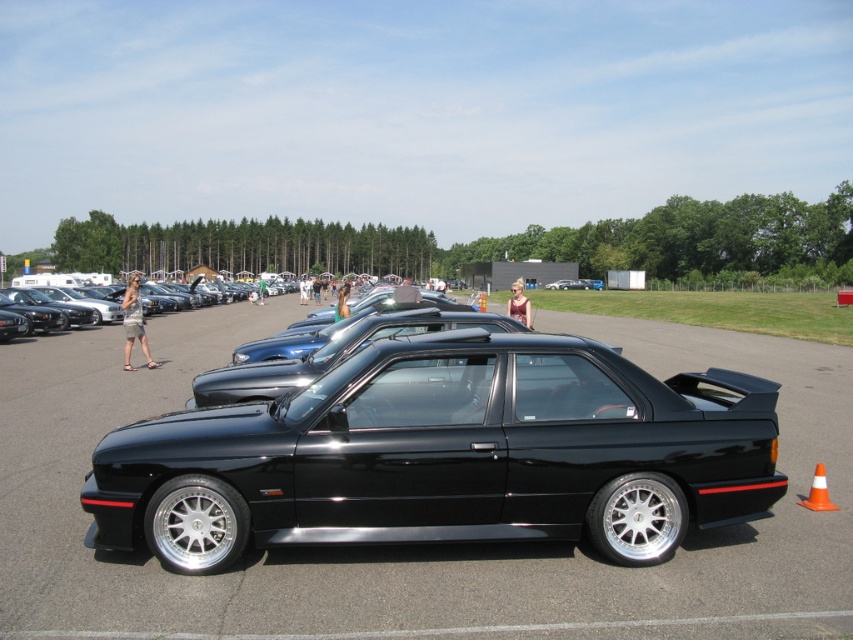
Question: Observing the image, what is the correct spatial positioning of blonde hair at center in reference to black matte car at center?

Choices:
 (A) right
 (B) left

Answer: (B)

Question: Does shiny black car at center appear on the left side of denim shorts at center?

Choices:
 (A) yes
 (B) no

Answer: (B)

Question: Among these objects, which one is nearest to the camera?

Choices:
 (A) shiny black car at center
 (B) orange/cone at lower right
 (C) green fabric shirt at center

Answer: (A)

Question: Considering the real-world distances, which object is closest to the blonde hair at center?

Choices:
 (A) black matte car at center
 (B) green fabric shirt at center
 (C) black glossy sedan at center

Answer: (C)

Question: Which object appears farthest from the camera in this image?

Choices:
 (A) green fabric shirt at center
 (B) black matte car at center
 (C) black glossy sedan at center
 (D) orange/cone at lower right

Answer: (B)

Question: Is blue denim shorts at center wider than green fabric shirt at center?

Choices:
 (A) no
 (B) yes

Answer: (A)